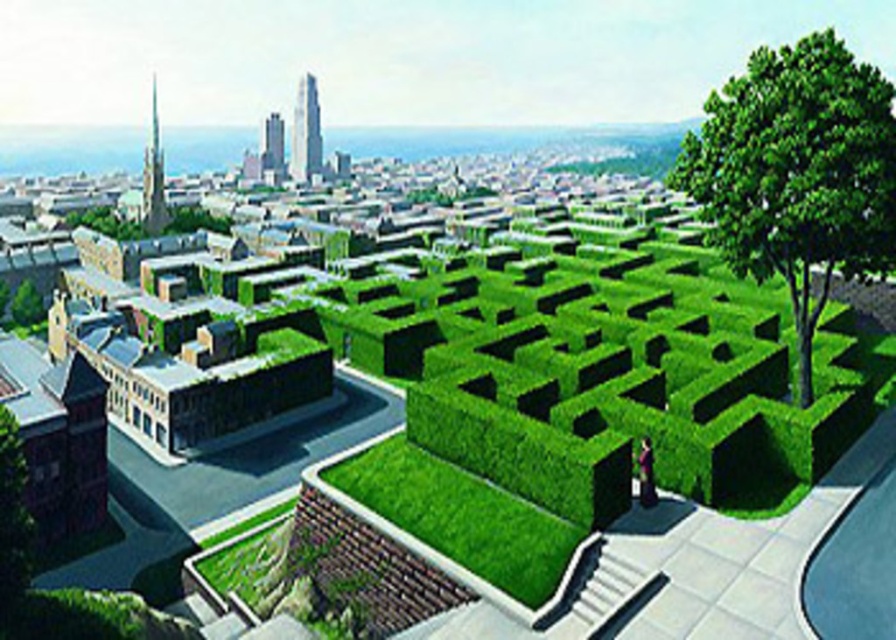
Question: Can you confirm if green leafy tree at upper right is positioned below green hedge at center?

Choices:
 (A) yes
 (B) no

Answer: (B)

Question: Can you confirm if green leafy tree at upper right is wider than green hedge at center?

Choices:
 (A) no
 (B) yes

Answer: (B)

Question: Among these objects, which one is farthest from the camera?

Choices:
 (A) green leafy tree at upper right
 (B) green hedge at center

Answer: (A)

Question: Is green leafy tree at upper right closer to the viewer compared to green hedge at center?

Choices:
 (A) no
 (B) yes

Answer: (A)

Question: Which of the following is the farthest from the observer?

Choices:
 (A) (536, 522)
 (B) (751, 157)

Answer: (B)